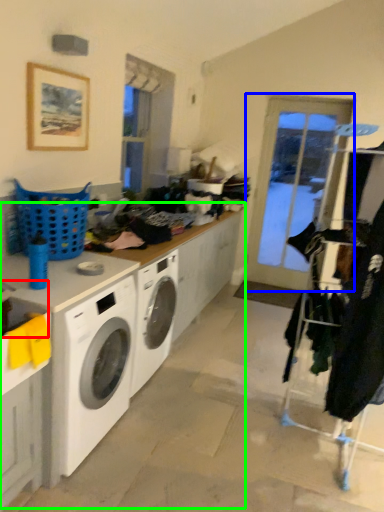
Question: Which object is positioned farthest from sink (highlighted by a red box)? Select from screen door (highlighted by a blue box) and counter top (highlighted by a green box).

Choices:
 (A) screen door
 (B) counter top

Answer: (A)